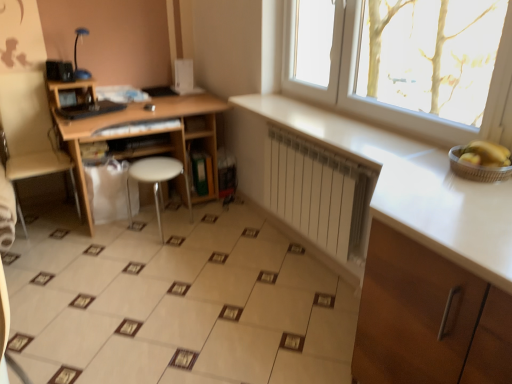
Question: Is metallic silver basket at right facing towards wooden desk at left?

Choices:
 (A) yes
 (B) no

Answer: (B)

Question: Can you confirm if metallic silver basket at right is positioned to the left of wooden desk at left?

Choices:
 (A) no
 (B) yes

Answer: (A)

Question: Is metallic silver basket at right facing away from wooden desk at left?

Choices:
 (A) yes
 (B) no

Answer: (B)

Question: Can you confirm if metallic silver basket at right is bigger than wooden desk at left?

Choices:
 (A) yes
 (B) no

Answer: (B)

Question: Considering the relative positions of metallic silver basket at right and wooden desk at left in the image provided, is metallic silver basket at right to the right of wooden desk at left from the viewer's perspective?

Choices:
 (A) no
 (B) yes

Answer: (B)

Question: Would you say wooden desk at left is part of metallic silver basket at right's contents?

Choices:
 (A) yes
 (B) no

Answer: (B)

Question: Is yellow matte banana at right not near white plastic stool at center?

Choices:
 (A) no
 (B) yes

Answer: (B)

Question: Is yellow matte banana at right touching white plastic stool at center?

Choices:
 (A) yes
 (B) no

Answer: (B)

Question: Is yellow matte banana at right closer to the viewer compared to white plastic stool at center?

Choices:
 (A) no
 (B) yes

Answer: (B)

Question: Is yellow matte banana at right located outside white plastic stool at center?

Choices:
 (A) yes
 (B) no

Answer: (A)

Question: Can you confirm if yellow matte banana at right is taller than white plastic stool at center?

Choices:
 (A) yes
 (B) no

Answer: (B)

Question: Is yellow matte banana at right shorter than white plastic stool at center?

Choices:
 (A) yes
 (B) no

Answer: (A)

Question: Is white matte radiator at center positioned beyond the bounds of beige ceramic tile at center?

Choices:
 (A) no
 (B) yes

Answer: (B)